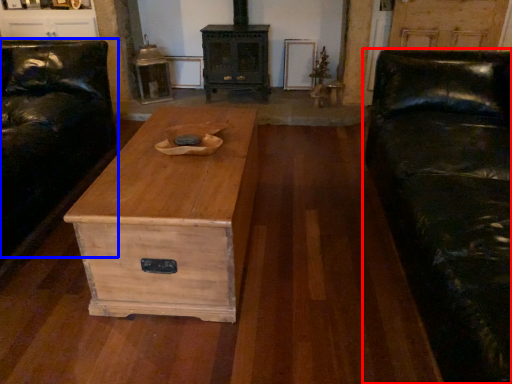
Question: Which object appears farthest to the camera in this image, studio couch (highlighted by a red box) or couch (highlighted by a blue box)?

Choices:
 (A) studio couch
 (B) couch

Answer: (B)